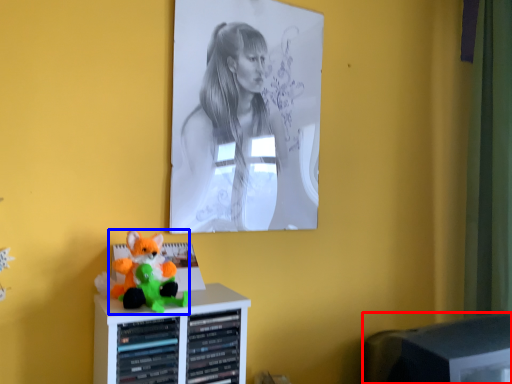
Question: Which of the following is the closest to the observer, computer monitor (highlighted by a red box) or toy (highlighted by a blue box)?

Choices:
 (A) computer monitor
 (B) toy

Answer: (B)